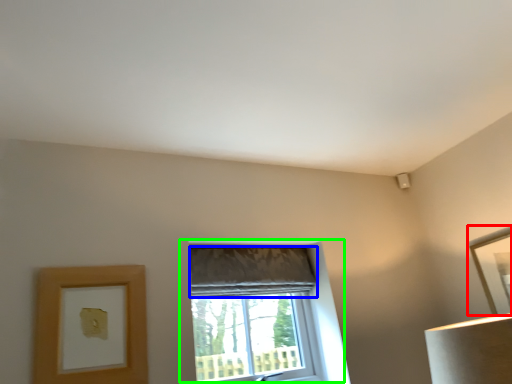
Question: Based on their relative distances, which object is farther from picture frame (highlighted by a red box)? Choose from curtain (highlighted by a blue box) and window (highlighted by a green box).

Choices:
 (A) curtain
 (B) window

Answer: (A)